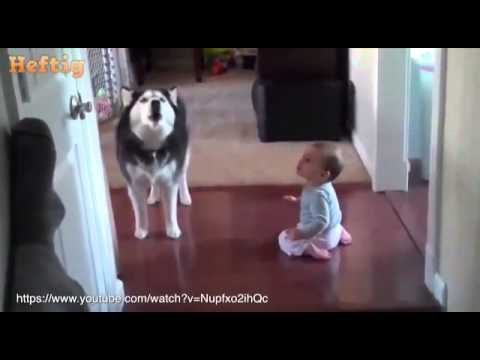
This screenshot has height=360, width=480. I want to click on bare floor, so pos(250,260).